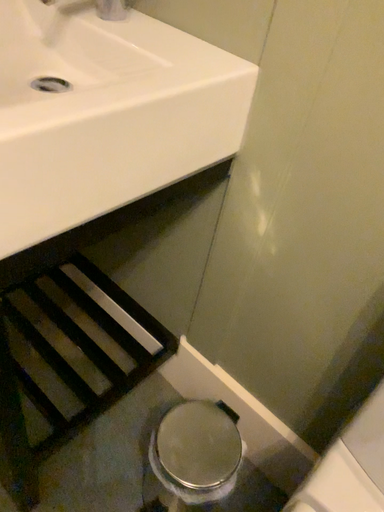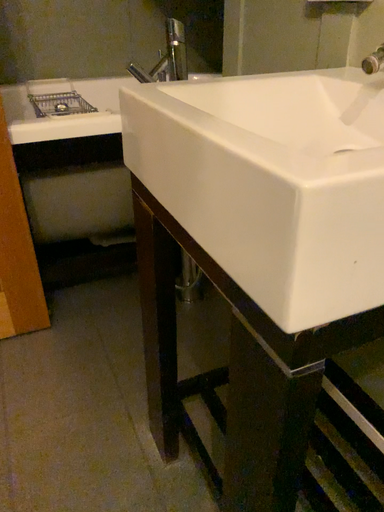
Question: How did the camera likely rotate when shooting the video?

Choices:
 (A) rotated downward
 (B) rotated upward

Answer: (B)